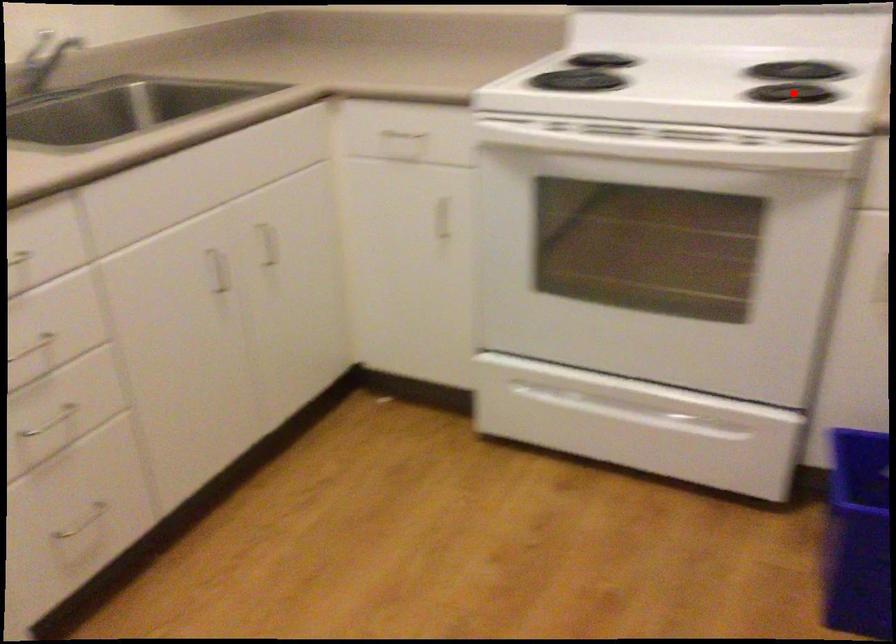
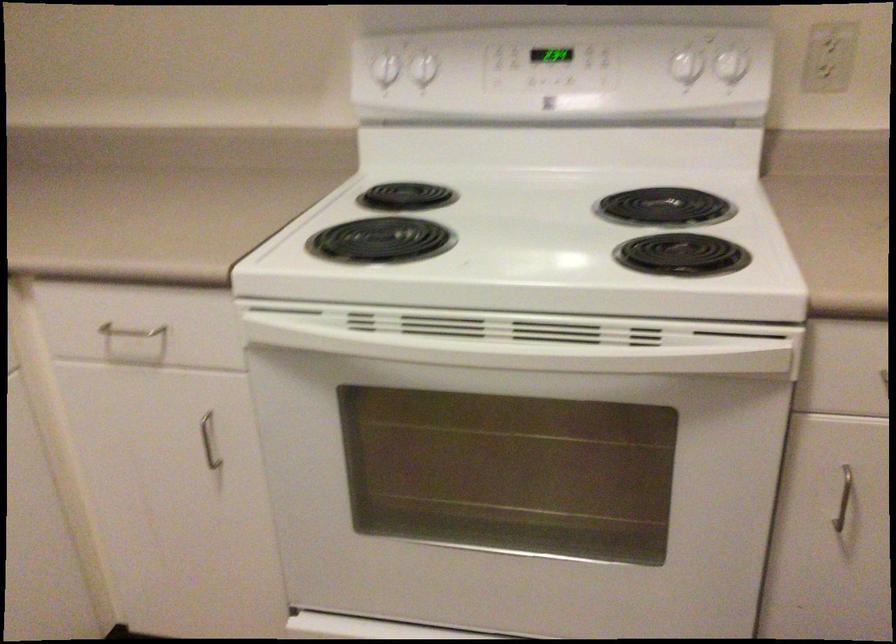
Question: A red point is marked in image1. In image2, is the corresponding 3D point closer to the camera or farther? Reply with the corresponding letter.

Choices:
 (A) The corresponding 3D point is closer.
 (B) The corresponding 3D point is farther.

Answer: (A)